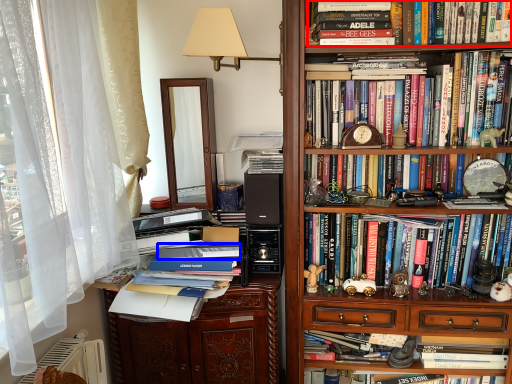
Question: Which point is further to the camera, book (highlighted by a red box) or paperback book (highlighted by a blue box)?

Choices:
 (A) book
 (B) paperback book

Answer: (B)